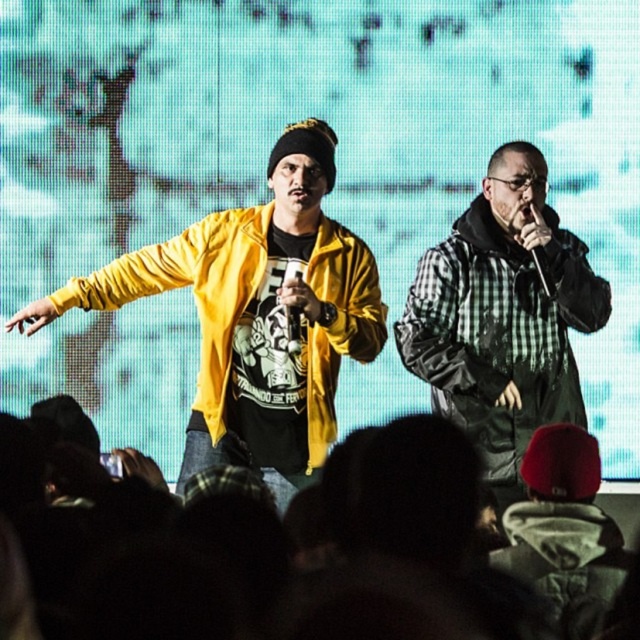
You are a photographer at the back of the venue and want to take a clear photo of the yellow matte jacket at left and the metallic silver microphone at center. Which object will appear larger in your photo?

The yellow matte jacket at left will appear larger in the photo because it is closer to the viewer than the metallic silver microphone at center.